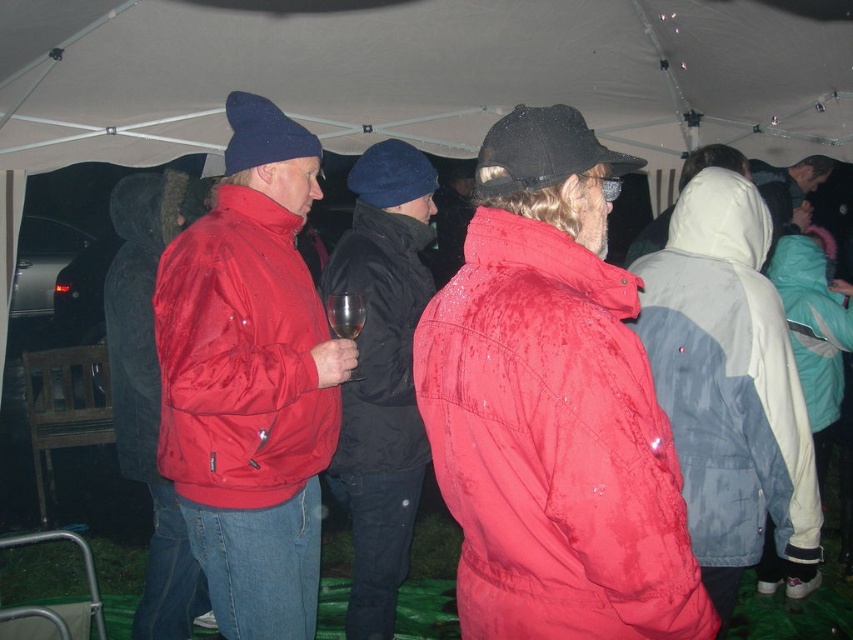
Between matte red jacket at center and matte red jacket at left, which one has more height?

With more height is matte red jacket at left.

Who is more distant from viewer, (556, 577) or (136, 433)?

The point (136, 433) is more distant.

Where is `matte red jacket at center`? The height and width of the screenshot is (640, 853). matte red jacket at center is located at coordinates (553, 445).

Is gray/white textured jacket at center smaller than shiny red jacket at center?

Indeed, gray/white textured jacket at center has a smaller size compared to shiny red jacket at center.

Looking at this image, does gray/white textured jacket at center lie behind shiny red jacket at center?

Yes, gray/white textured jacket at center is further from the viewer.

Is point (756, 428) in front of point (202, 241)?

Yes, point (756, 428) is closer to viewer.

Locate an element on the screen. The image size is (853, 640). gray/white textured jacket at center is located at coordinates (728, 378).

Does matte red jacket at left appear on the right side of teal fleece jacket at right?

In fact, matte red jacket at left is to the left of teal fleece jacket at right.

The width and height of the screenshot is (853, 640). What do you see at coordinates (141, 305) in the screenshot? I see `matte red jacket at left` at bounding box center [141, 305].

The width and height of the screenshot is (853, 640). What do you see at coordinates (141, 305) in the screenshot?
I see `matte red jacket at left` at bounding box center [141, 305].

Identify the location of matte red jacket at left. The image size is (853, 640). (141, 305).